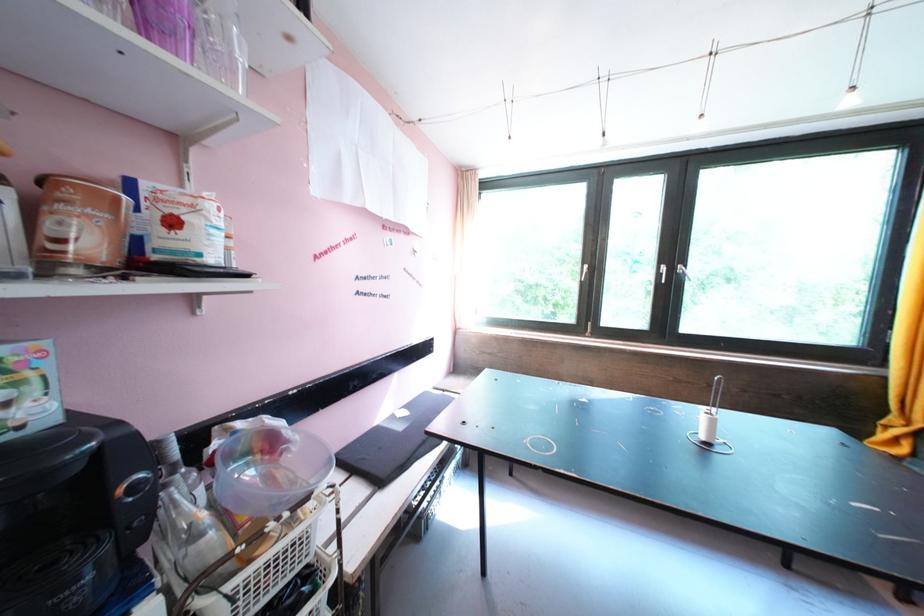
Identify the location of white flour bag. This screenshot has height=616, width=924. (186, 227).